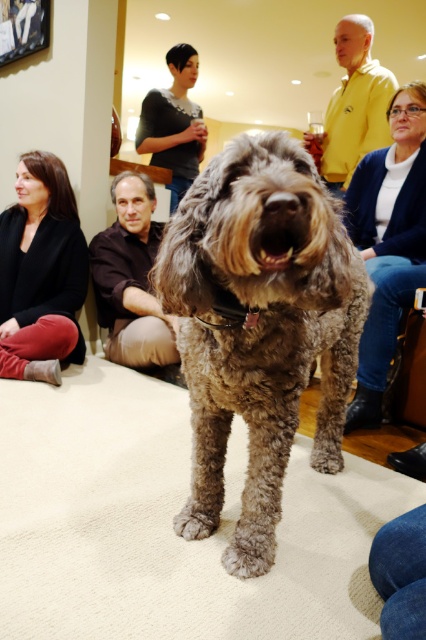
Question: Which object appears farthest from the camera in this image?

Choices:
 (A) yellow smooth shirt at upper center
 (B) denim jacket at lower right

Answer: (A)

Question: Does denim jacket at lower right have a larger size compared to brown leather jacket at lower center?

Choices:
 (A) no
 (B) yes

Answer: (B)

Question: From the image, what is the correct spatial relationship of fuzzy brown dog at center in relation to dark gray sweater at upper center?

Choices:
 (A) left
 (B) right

Answer: (B)

Question: Based on their relative distances, which object is nearer to the matte black jacket at lower left?

Choices:
 (A) denim jacket at lower right
 (B) brown leather jacket at lower center
 (C) yellow smooth shirt at upper center
 (D) faded denim jeans at lower right

Answer: (B)

Question: Which object is closer to the camera taking this photo?

Choices:
 (A) fuzzy brown dog at center
 (B) yellow smooth shirt at upper center
 (C) brown leather jacket at lower center
 (D) faded denim jeans at lower right

Answer: (A)

Question: Considering the relative positions of brown leather jacket at lower center and faded denim jeans at lower right in the image provided, where is brown leather jacket at lower center located with respect to faded denim jeans at lower right?

Choices:
 (A) left
 (B) right

Answer: (A)